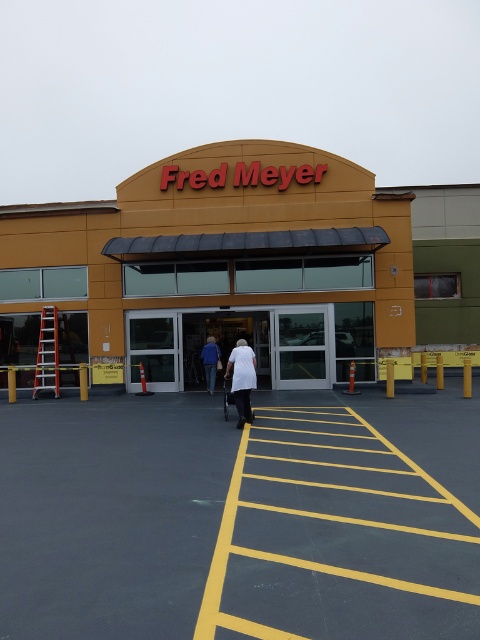
Question: Which point appears farthest from the camera in this image?

Choices:
 (A) pyautogui.click(x=244, y=364)
 (B) pyautogui.click(x=207, y=348)
 (C) pyautogui.click(x=322, y=412)
 (D) pyautogui.click(x=83, y=275)

Answer: (D)

Question: Where is yellow asphalt at center located in relation to yellow matte building at center in the image?

Choices:
 (A) below
 (B) above

Answer: (A)

Question: Is yellow matte building at center above white matte shirt at center?

Choices:
 (A) no
 (B) yes

Answer: (B)

Question: Does yellow matte building at center appear on the left side of white matte jacket at center?

Choices:
 (A) yes
 (B) no

Answer: (B)

Question: Which of the following is the farthest from the observer?

Choices:
 (A) (109, 432)
 (B) (249, 412)
 (C) (467, 326)
 (D) (211, 369)

Answer: (C)

Question: Among these objects, which one is nearest to the camera?

Choices:
 (A) white matte shirt at center
 (B) yellow asphalt at center
 (C) white matte jacket at center
 (D) yellow matte building at center

Answer: (B)